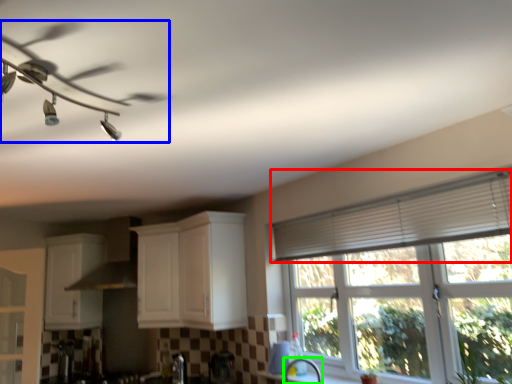
Question: Which object is positioned farthest from shutter (highlighted by a red box)? Select from ceiling fan (highlighted by a blue box) and faucet (highlighted by a green box).

Choices:
 (A) ceiling fan
 (B) faucet

Answer: (A)